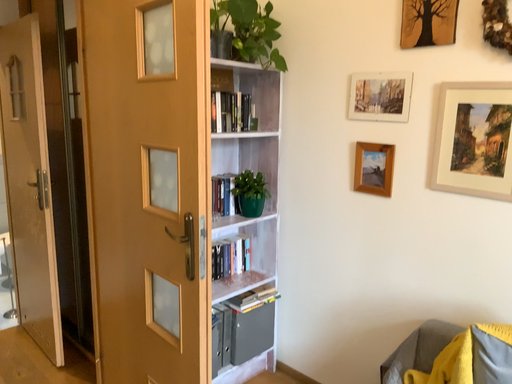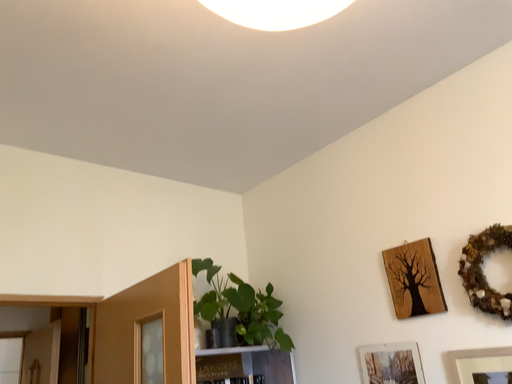
Question: Which way did the camera rotate in the video?

Choices:
 (A) rotated upward
 (B) rotated downward

Answer: (A)